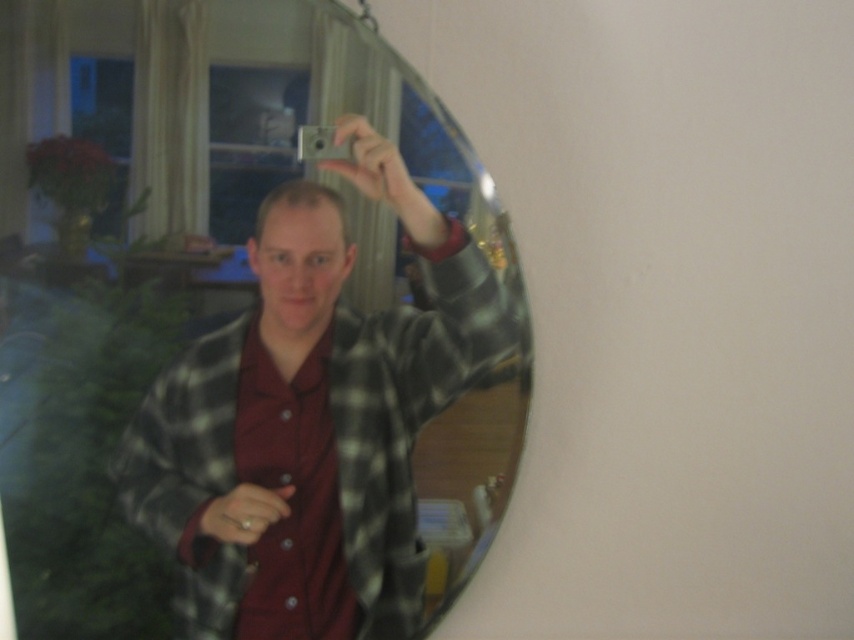
Question: Is the position of plaid flannel shirt at center more distant than that of maroon button-up shirt at center?

Choices:
 (A) yes
 (B) no

Answer: (B)

Question: Is plaid flannel shirt at center positioned behind maroon button-up shirt at center?

Choices:
 (A) yes
 (B) no

Answer: (B)

Question: Can you confirm if plaid flannel shirt at center is positioned above maroon button-up shirt at center?

Choices:
 (A) no
 (B) yes

Answer: (B)